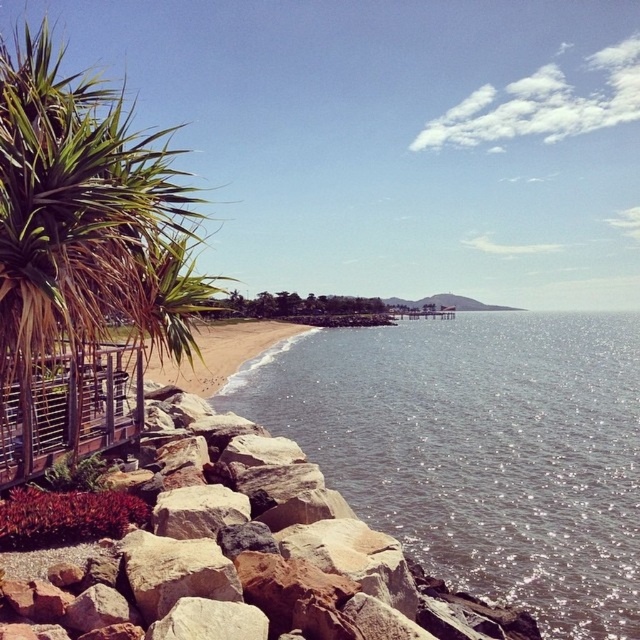
You are planning to set up a small tent in this coastal area. Considering the space available, which object from the scene would be more suitable to place the tent on, the green leafy palm tree at left or the beige sand at center?

The beige sand at center occupies more space than the green leafy palm tree at left, making it a more suitable location for setting up the tent.

Consider the image. You are standing on the rocky shoreline and want to take a photo of the green leafy palm tree at left and the wooden lattice at lower left. Which object will appear closer to the camera in the photo?

The green leafy palm tree at left will appear closer to the camera because it is in front of the wooden lattice at lower left.